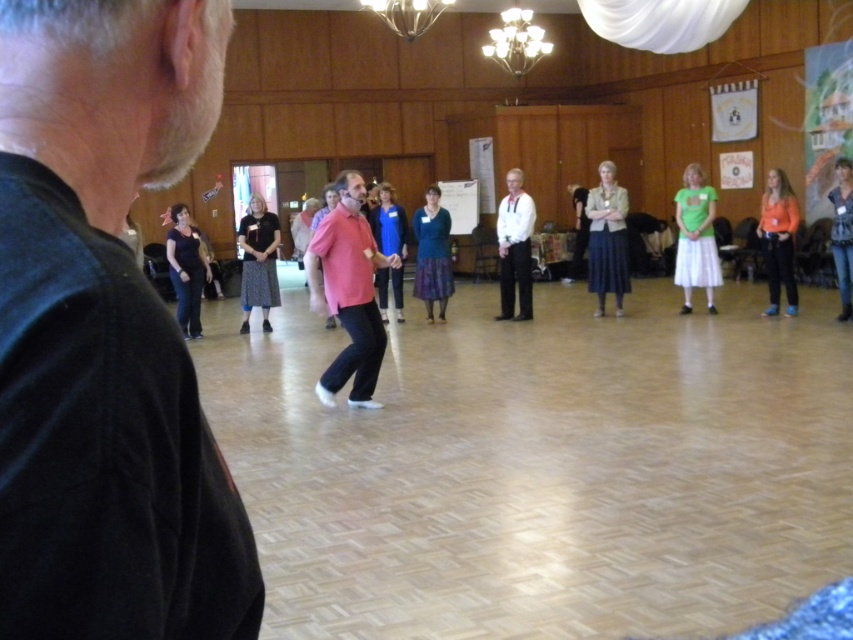
You are a photographer positioned in the back of the room. You need to capture a photo that includes both the white smooth shirt at center and the matte black shirt at center. Which shirt should you position closer to the camera to ensure both are fully visible in the frame?

The white smooth shirt at center is taller than the matte black shirt at center. To ensure both are fully visible, position the shorter matte black shirt at center closer to the camera so that its height matches the taller white smooth shirt at center in the photo.

Where is the pink matte shirt at center located in the image?

The pink matte shirt at center is located at point [347,292] in the image.